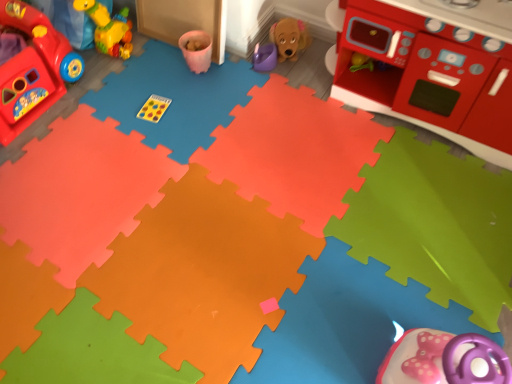
Question: Which direction should I rotate to look at purple plastic watering can at center, which is the third toy in left-to-right order, — up or down?

Choices:
 (A) up
 (B) down

Answer: (A)

Question: From the image's perspective, would you say rubber duck at upper left, which is the second toy in right-to-left order, is shown under rubberized red play kitchen at left, the 1th toy viewed from the left?

Choices:
 (A) yes
 (B) no

Answer: (B)

Question: From a real-world perspective, is rubber duck at upper left, which is counted as the second toy, starting from the left, on top of rubberized red play kitchen at left, the 3th toy positioned from the right?

Choices:
 (A) no
 (B) yes

Answer: (B)

Question: Can you confirm if rubber duck at upper left, which is counted as the second toy, starting from the left, is smaller than rubberized red play kitchen at left, the 1th toy viewed from the left?

Choices:
 (A) yes
 (B) no

Answer: (A)

Question: Can you confirm if rubber duck at upper left, which is the second toy in right-to-left order, is wider than rubberized red play kitchen at left, the 3th toy positioned from the right?

Choices:
 (A) yes
 (B) no

Answer: (B)

Question: Can you confirm if rubber duck at upper left, which is the second toy in right-to-left order, is shorter than rubberized red play kitchen at left, the 3th toy positioned from the right?

Choices:
 (A) no
 (B) yes

Answer: (B)

Question: Is rubber duck at upper left, which is the second toy in right-to-left order, behind rubberized red play kitchen at left, the 1th toy viewed from the left?

Choices:
 (A) yes
 (B) no

Answer: (A)

Question: From a real-world perspective, is purple plastic watering can at center, the first toy viewed from the right, positioned over rubber duck at upper left, which is counted as the second toy, starting from the left, based on gravity?

Choices:
 (A) yes
 (B) no

Answer: (B)

Question: From the image's perspective, is purple plastic watering can at center, which is the third toy in left-to-right order, located beneath rubber duck at upper left, which is counted as the second toy, starting from the left?

Choices:
 (A) yes
 (B) no

Answer: (A)

Question: Does purple plastic watering can at center, which is the third toy in left-to-right order, come in front of rubber duck at upper left, which is the second toy in right-to-left order?

Choices:
 (A) no
 (B) yes

Answer: (A)

Question: Is purple plastic watering can at center, the first toy viewed from the right, shorter than rubber duck at upper left, which is the second toy in right-to-left order?

Choices:
 (A) no
 (B) yes

Answer: (B)

Question: Is purple plastic watering can at center, which is the third toy in left-to-right order, aimed at rubber duck at upper left, which is the second toy in right-to-left order?

Choices:
 (A) no
 (B) yes

Answer: (A)

Question: Is rubberized red play kitchen at left, the 3th toy positioned from the right, at the right side of smooth plastic toy stove at upper right?

Choices:
 (A) yes
 (B) no

Answer: (B)